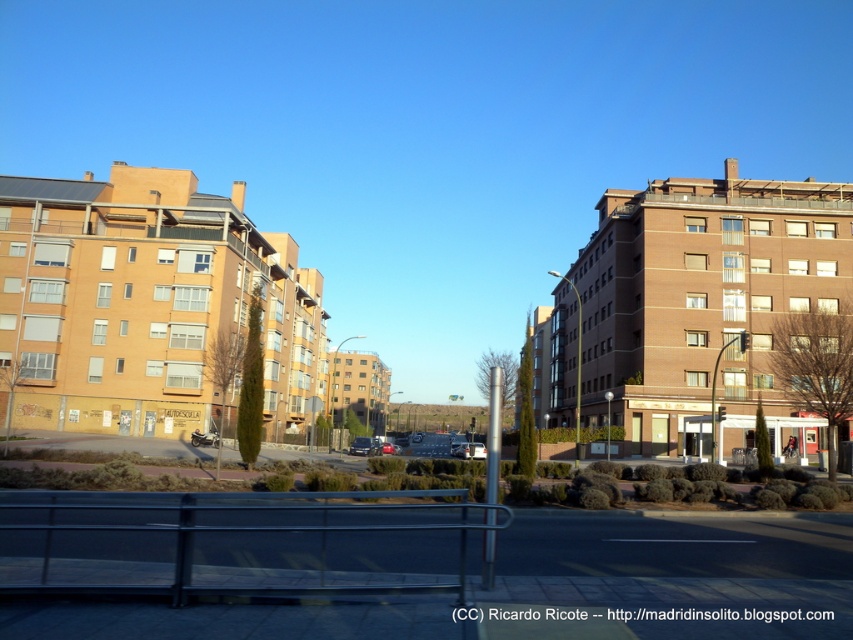
Who is higher up, silver metallic car at center or shiny metallic car at center?

Positioned higher is silver metallic car at center.

Is point (453, 449) in front of point (357, 438)?

No, it is not.

At what (x,y) coordinates should I click in order to perform the action: click on silver metallic car at center. Please return your answer as a coordinate pair (x, y). This screenshot has height=640, width=853. Looking at the image, I should click on (469, 451).

Which of these two, metallic silver car at center or silver metallic car at center, stands taller?

With more height is silver metallic car at center.

Is metallic silver car at center to the left of silver metallic car at center from the viewer's perspective?

Correct, you'll find metallic silver car at center to the left of silver metallic car at center.

Which is in front, point (354, 449) or point (459, 449)?

Point (354, 449) is more forward.

The image size is (853, 640). What are the coordinates of `metallic silver car at center` in the screenshot? It's located at (364, 445).

Who is taller, metallic silver car at center or shiny metallic car at center?

shiny metallic car at center

Which is below, metallic silver car at center or shiny metallic car at center?

Positioned lower is shiny metallic car at center.

Find the location of `metallic silver car at center`. metallic silver car at center is located at coordinates (364, 445).

Locate an element on the screen. The width and height of the screenshot is (853, 640). metallic silver car at center is located at coordinates (364, 445).